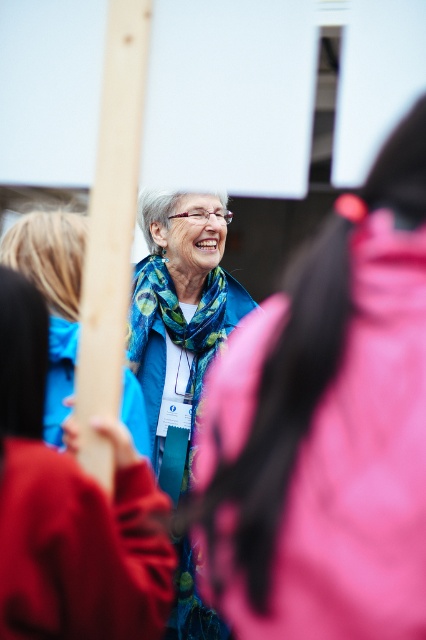
Does blue fabric jacket at center have a lesser height compared to matte blue scarf at center?

Correct, blue fabric jacket at center is not as tall as matte blue scarf at center.

Which is below, blue fabric jacket at center or matte blue scarf at center?

Positioned lower is blue fabric jacket at center.

Describe the element at coordinates (348, 474) in the screenshot. This screenshot has height=640, width=426. I see `blue fabric jacket at center` at that location.

Locate an element on the screen. This screenshot has width=426, height=640. blue fabric jacket at center is located at coordinates (348, 474).